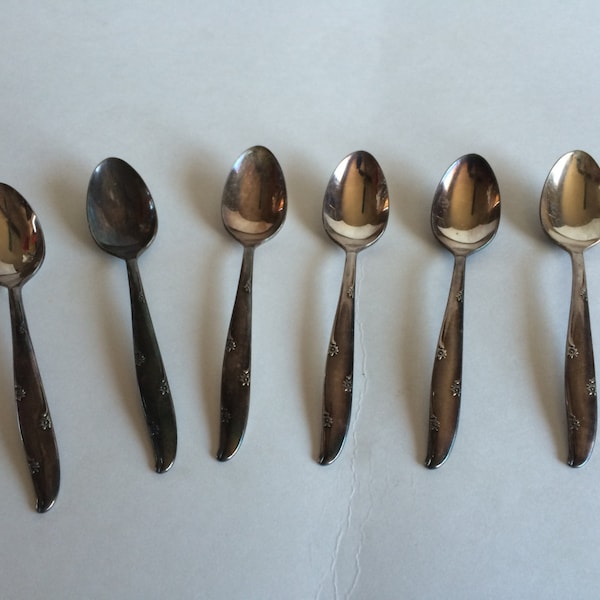
This screenshot has width=600, height=600. Find the location of `spoon handles`. spoon handles is located at coordinates (21, 351), (156, 376), (236, 404), (341, 411), (439, 419), (575, 420).